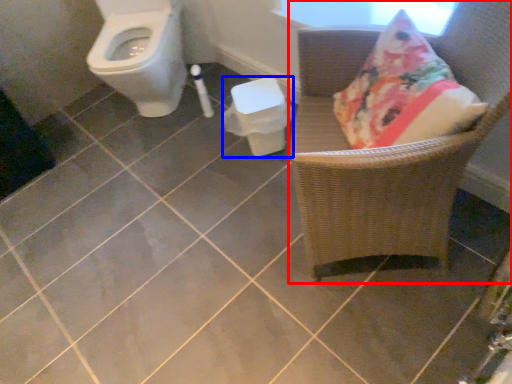
Question: Which object appears farthest to the camera in this image, chair (highlighted by a red box) or potty (highlighted by a blue box)?

Choices:
 (A) chair
 (B) potty

Answer: (B)